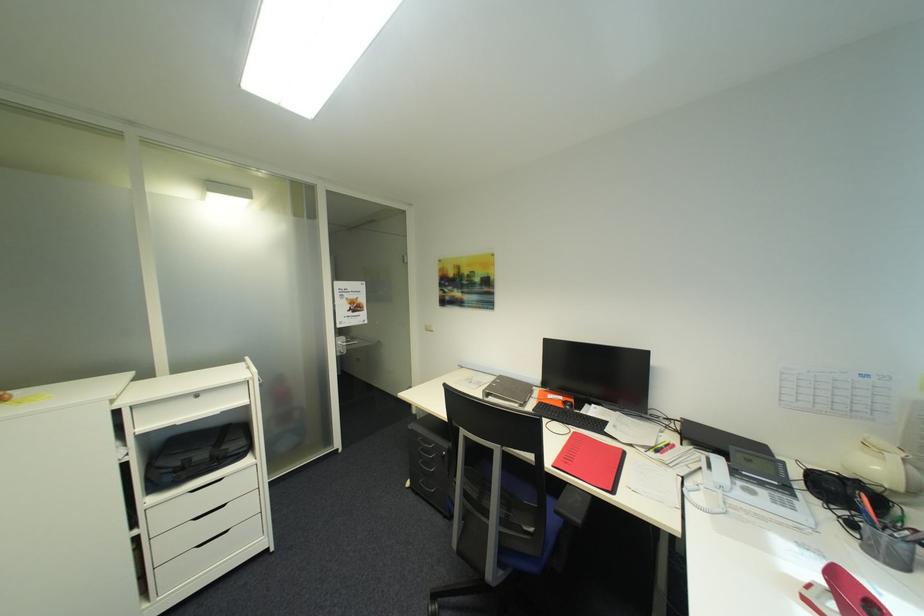
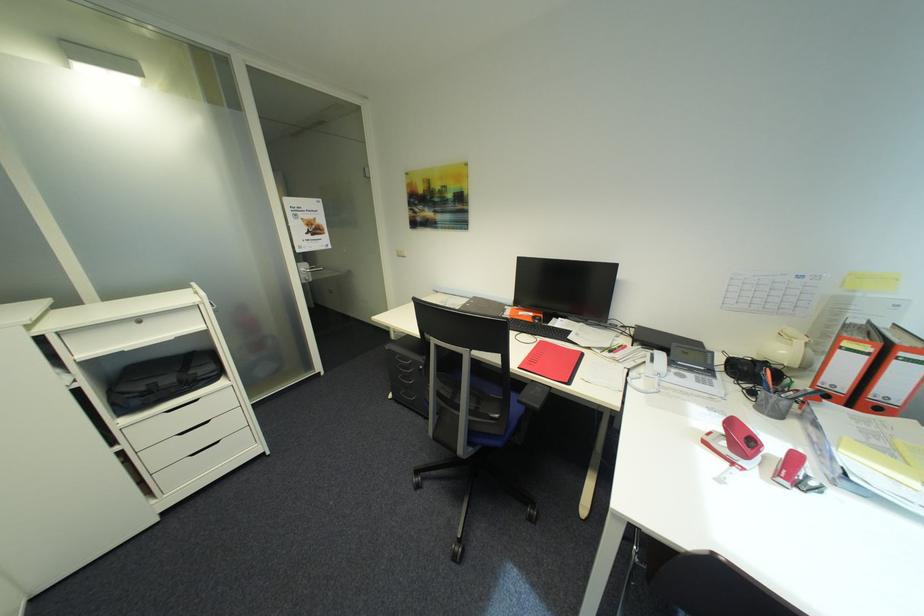
Where in the second image is the point corresponding to (188,464) from the first image?

(152, 389)